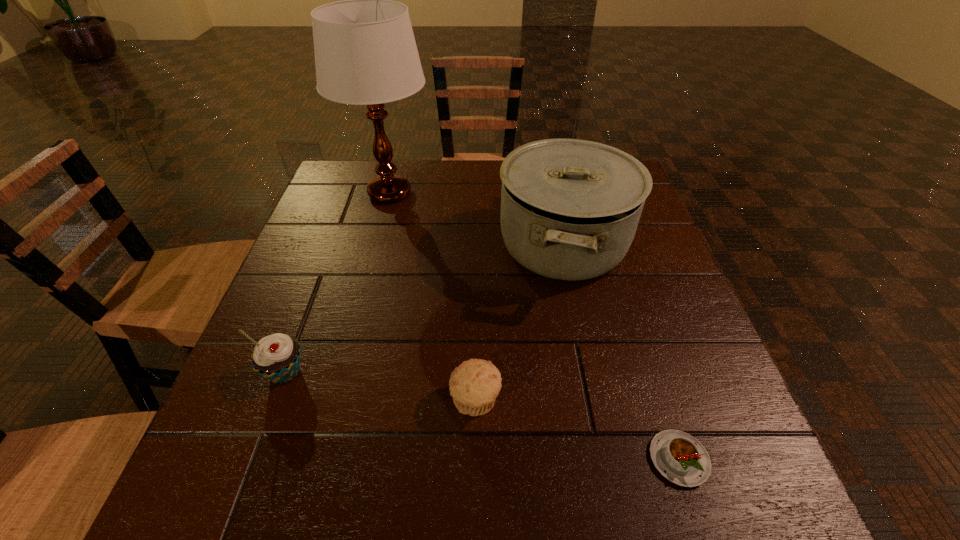
At what (x,y) coordinates should I click in order to perform the action: click on vacant area situated on the back of the fourth tallest object. Please return your answer as a coordinate pair (x, y). Image resolution: width=960 pixels, height=540 pixels. Looking at the image, I should click on (476, 283).

The height and width of the screenshot is (540, 960). I want to click on vacant space located 0.120m on the left of the nearest object, so click(571, 459).

This screenshot has height=540, width=960. In order to click on table lamp that is at the far edge in this screenshot , I will do `click(365, 52)`.

The image size is (960, 540). Find the location of `saucepan that is at the far edge`. saucepan that is at the far edge is located at coordinates (570, 208).

Locate an element on the screen. object located in the near edge section of the desktop is located at coordinates coord(682,459).

The width and height of the screenshot is (960, 540). Find the location of `table lamp present at the left edge`. table lamp present at the left edge is located at coordinates (365, 52).

Locate an element on the screen. The width and height of the screenshot is (960, 540). cupcake located at the left edge is located at coordinates (276, 357).

This screenshot has height=540, width=960. I want to click on saucepan that is at the right edge, so click(x=570, y=208).

This screenshot has height=540, width=960. Identify the location of pudding present at the right edge. (682, 459).

The width and height of the screenshot is (960, 540). I want to click on object at the far left corner, so click(365, 52).